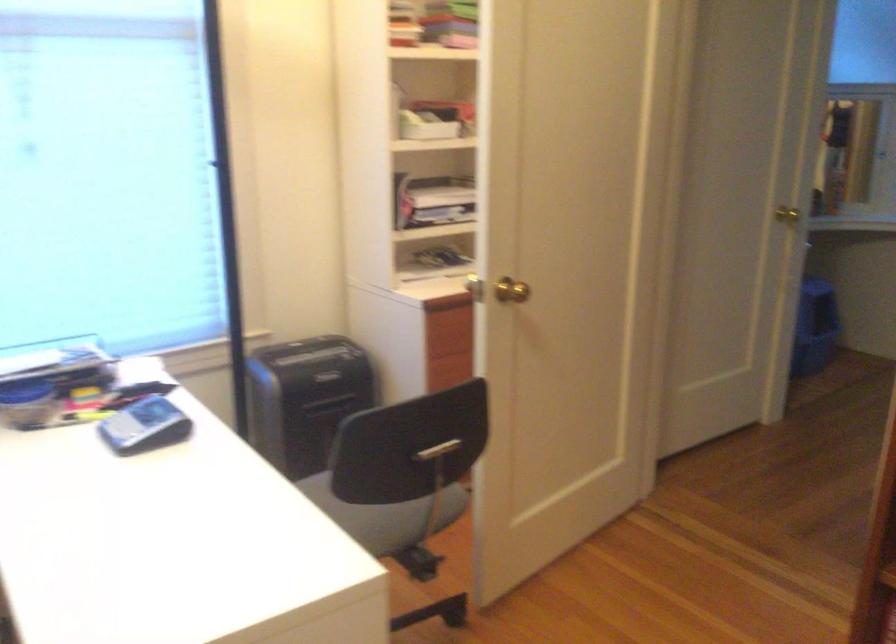
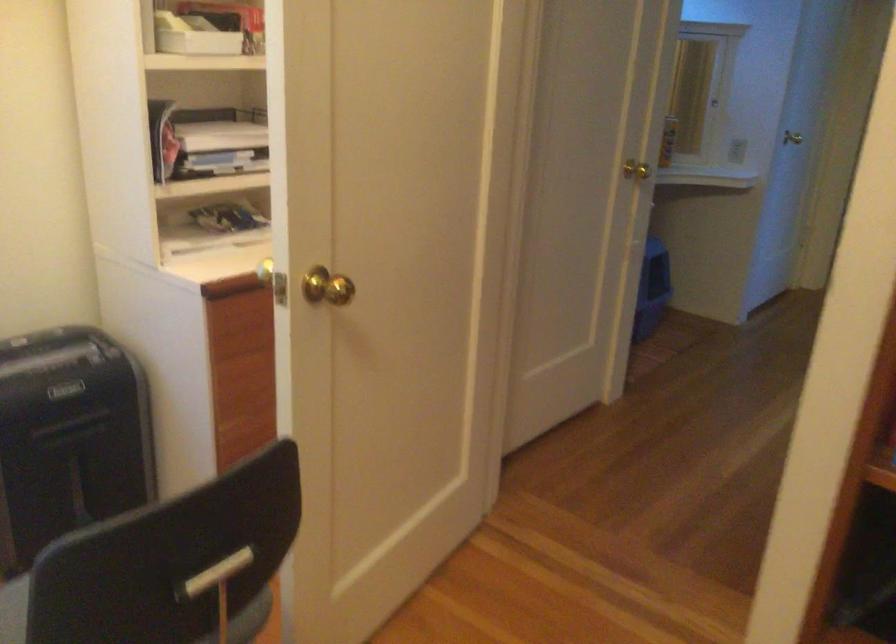
Question: How did the camera likely rotate?

Choices:
 (A) Left
 (B) Right
 (C) Up
 (D) Down

Answer: (B)